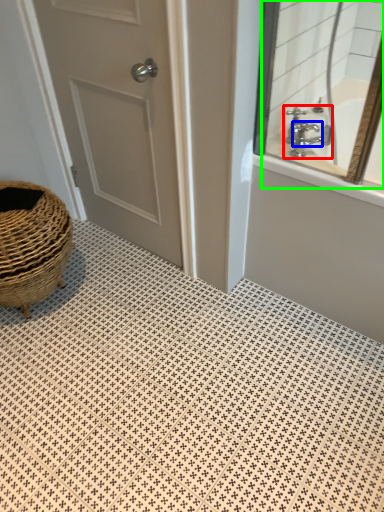
Question: Based on their relative distances, which object is farther from tap (highlighted by a red box)? Choose from faucet (highlighted by a blue box) and mirror (highlighted by a green box).

Choices:
 (A) faucet
 (B) mirror

Answer: (B)